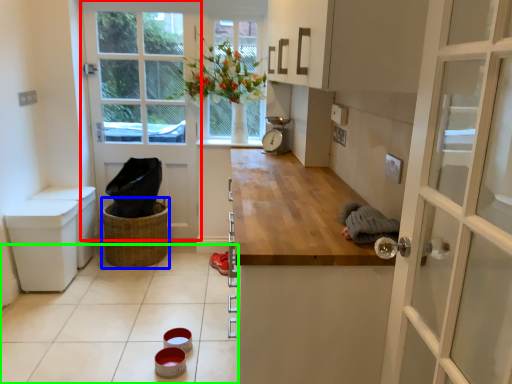
Question: Which object is the farthest from door (highlighted by a red box)? Choose among these: basket (highlighted by a blue box) or tile (highlighted by a green box).

Choices:
 (A) basket
 (B) tile

Answer: (B)